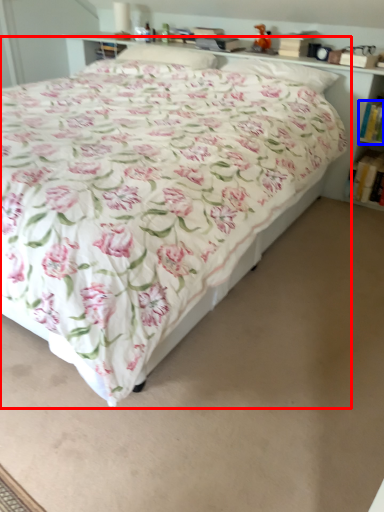
Question: Which of the following is the farthest to the observer, bed (highlighted by a red box) or book (highlighted by a blue box)?

Choices:
 (A) bed
 (B) book

Answer: (B)